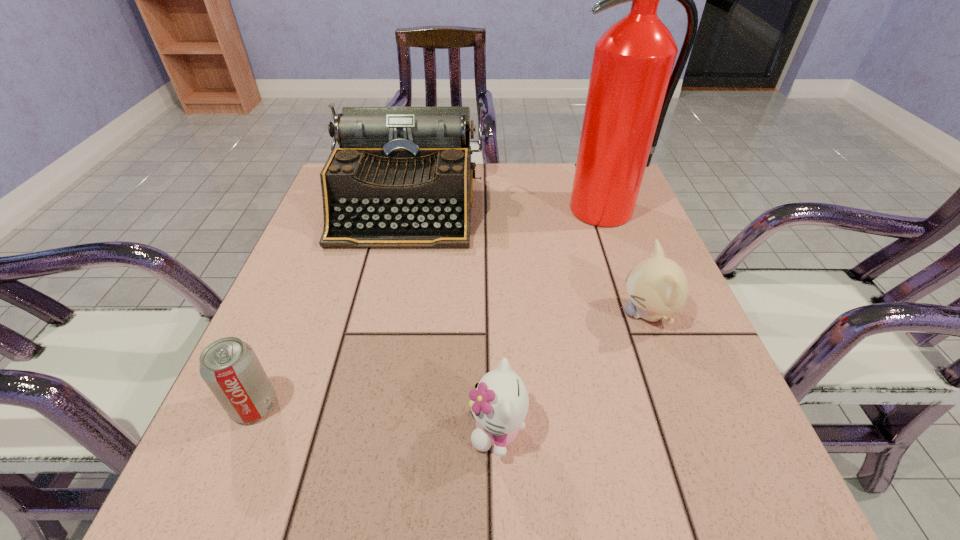
Locate an element on the screen. free space located on the face of the farther kitten is located at coordinates (480, 314).

Find the location of `vacant space located 0.200m on the right of the soda can`. vacant space located 0.200m on the right of the soda can is located at coordinates (400, 405).

Where is `free space located on the front-facing side of the nearer kitten`? The image size is (960, 540). free space located on the front-facing side of the nearer kitten is located at coordinates (210, 430).

The width and height of the screenshot is (960, 540). Find the location of `free space located on the front-facing side of the nearer kitten`. free space located on the front-facing side of the nearer kitten is located at coordinates (385, 430).

The width and height of the screenshot is (960, 540). I want to click on vacant space located 0.140m on the front-facing side of the nearer kitten, so click(x=379, y=430).

Where is `fire extinguisher positioned at the far edge`? The height and width of the screenshot is (540, 960). fire extinguisher positioned at the far edge is located at coordinates (631, 85).

Where is `typewriter that is positioned at the far edge`? The width and height of the screenshot is (960, 540). typewriter that is positioned at the far edge is located at coordinates (402, 178).

Where is `object present at the near edge`? Image resolution: width=960 pixels, height=540 pixels. object present at the near edge is located at coordinates (499, 403).

Locate an element on the screen. The height and width of the screenshot is (540, 960). typewriter located at the left edge is located at coordinates (402, 178).

At what (x,y) coordinates should I click in order to perform the action: click on soda can present at the left edge. Please return your answer as a coordinate pair (x, y). The width and height of the screenshot is (960, 540). Looking at the image, I should click on (230, 368).